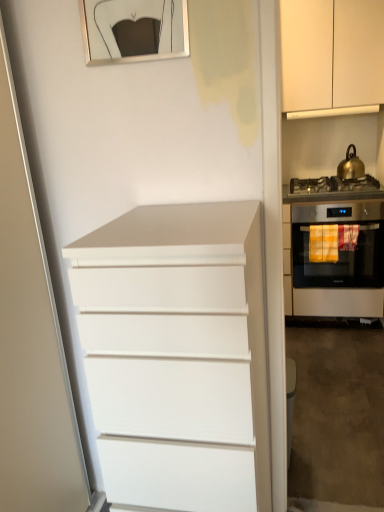
This screenshot has width=384, height=512. I want to click on empty space that is ontop of white matte chest of drawers at center (from a real-world perspective), so click(186, 215).